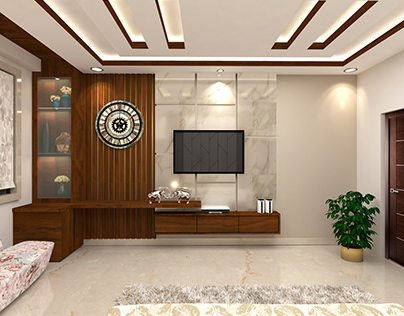
Locate an element on the screen. This screenshot has height=316, width=404. window frame is located at coordinates (17, 194).